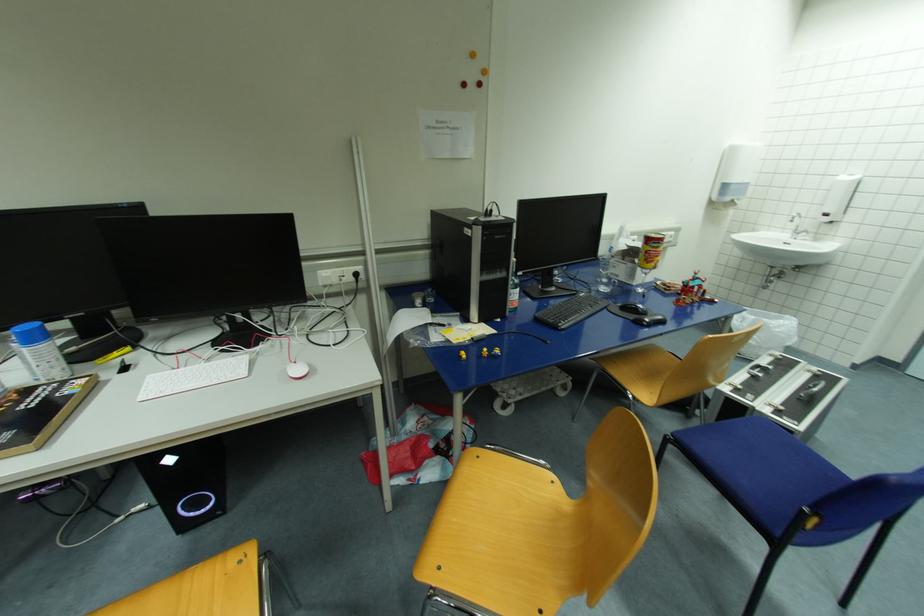
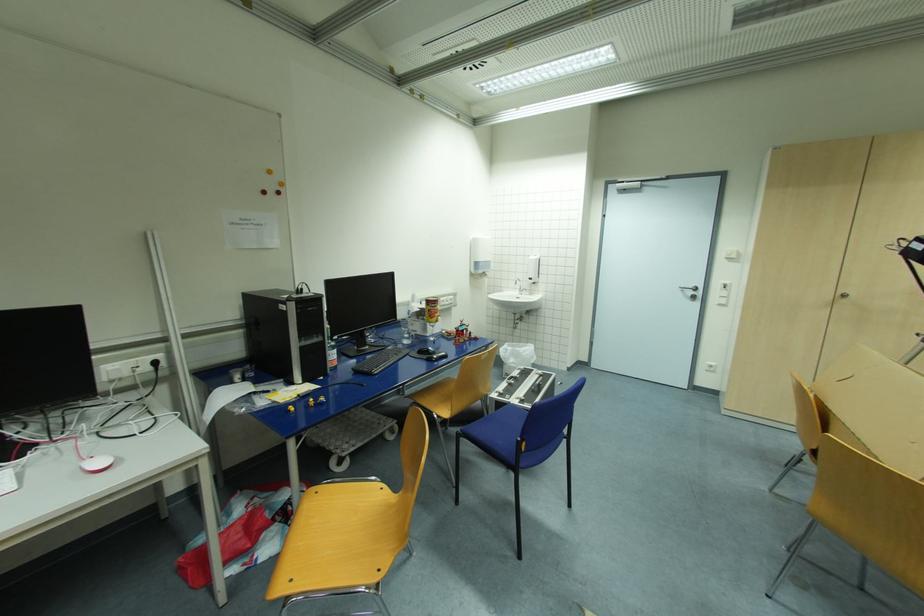
Find the pixel in the second image that matches [653,241] in the first image.

(433, 302)